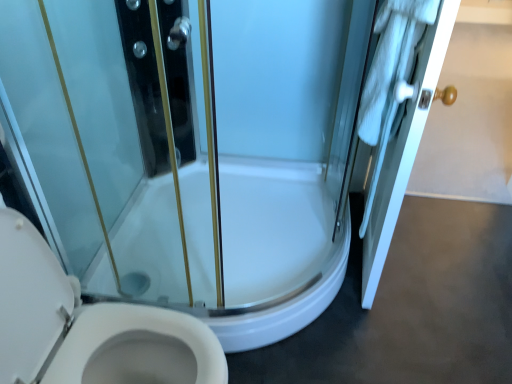
Measure the distance between white wood door at right and camera.

A distance of 38.61 inches exists between white wood door at right and camera.

Image resolution: width=512 pixels, height=384 pixels. Describe the element at coordinates (404, 149) in the screenshot. I see `white wood door at right` at that location.

This screenshot has width=512, height=384. I want to click on white wood door at right, so click(404, 149).

Locate an element on the screen. Image resolution: width=512 pixels, height=384 pixels. white glossy toilet at lower left is located at coordinates (88, 326).

The image size is (512, 384). What do you see at coordinates (88, 326) in the screenshot?
I see `white glossy toilet at lower left` at bounding box center [88, 326].

You are a GUI agent. You are given a task and a screenshot of the screen. Output one action in this format:
    pyautogui.click(x=<x>, y=<y>)
    Task: Click on the white wood door at right
    
    Given the screenshot: What is the action you would take?
    pos(404,149)

Between white glossy toilet at lower left and white wood door at right, which one appears on the right side from the viewer's perspective?

white wood door at right.

Considering the positions of objects white glossy toilet at lower left and white wood door at right in the image provided, who is behind, white glossy toilet at lower left or white wood door at right?

white wood door at right.

Does point (37, 244) appear closer or farther from the camera than point (395, 197)?

Point (37, 244) appears to be closer to the viewer than point (395, 197).

From the image's perspective, relative to white wood door at right, is white glossy toilet at lower left above or below?

From the image's perspective, white glossy toilet at lower left appears below white wood door at right.

From a real-world perspective, between white glossy toilet at lower left and white wood door at right, who is vertically higher?

In real-world perspective, white wood door at right is above.

Which object is thinner, white glossy toilet at lower left or white wood door at right?

Thinner between the two is white wood door at right.

Does white glossy toilet at lower left have a lesser height compared to white wood door at right?

Yes.

Is white glossy toilet at lower left smaller than white wood door at right?

No.

Does white glossy toilet at lower left contain white wood door at right?

No, white wood door at right is not a part of white glossy toilet at lower left.

Is white glossy toilet at lower left far from white wood door at right?

No, there isn't a large distance between white glossy toilet at lower left and white wood door at right.

Could you tell me if white glossy toilet at lower left is facing white wood door at right?

No, white glossy toilet at lower left does not turn towards white wood door at right.

In order to click on door behind the white glossy toilet at lower left in this screenshot , I will do `click(404, 149)`.

Considering the relative positions of white wood door at right and white glossy toilet at lower left in the image provided, is white wood door at right to the right of white glossy toilet at lower left from the viewer's perspective?

Yes, white wood door at right is to the right of white glossy toilet at lower left.

Which object is further away from the camera, white wood door at right or white glossy toilet at lower left?

white wood door at right.

Is point (386, 172) closer or farther from the camera than point (71, 347)?

Point (386, 172) appears to be farther away from the viewer than point (71, 347).

From the image's perspective, is white wood door at right located above or below white glossy toilet at lower left?

Clearly, from the image's perspective, white wood door at right is above white glossy toilet at lower left.

From a real-world perspective, is white wood door at right physically above white glossy toilet at lower left?

Yes, from a real-world perspective, white wood door at right is on top of white glossy toilet at lower left.

Does white wood door at right have a greater width compared to white glossy toilet at lower left?

Incorrect, the width of white wood door at right does not surpass that of white glossy toilet at lower left.

From their relative heights in the image, would you say white wood door at right is taller or shorter than white glossy toilet at lower left?

In the image, white wood door at right appears to be taller than white glossy toilet at lower left.

Based on their sizes in the image, would you say white wood door at right is bigger or smaller than white glossy toilet at lower left?

white wood door at right is smaller than white glossy toilet at lower left.

Based on the photo, can white glossy toilet at lower left be found inside white wood door at right?

No, white glossy toilet at lower left is located outside of white wood door at right.

Is white wood door at right beside white glossy toilet at lower left?

No, white wood door at right is not beside white glossy toilet at lower left.

Is white wood door at right facing away from white glossy toilet at lower left?

No, white wood door at right is not facing away from white glossy toilet at lower left.

The image size is (512, 384). What are the coordinates of `toilet lying on the left of white wood door at right` in the screenshot? It's located at (88, 326).

Identify the location of toilet in front of the white wood door at right. (88, 326).

This screenshot has width=512, height=384. In the image, there is a white wood door at right. What are the coordinates of `toilet below it (from a real-world perspective)` in the screenshot? It's located at click(88, 326).